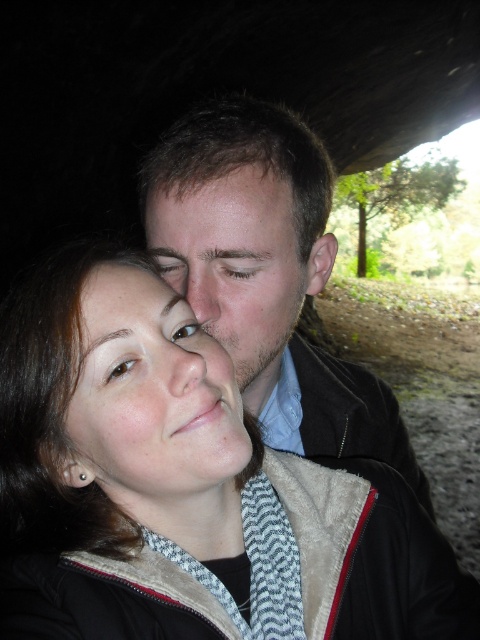
You are a photographer adjusting the lighting for a portrait. You notice two smooth skin faces in the frame. The smooth skin face at center belongs to the man, and the smooth skin face at upper center is the woman. Which face should you focus on to ensure proper exposure for the subject looking at the camera?

The smooth skin face at upper center is the woman, who is looking at the camera, so focus on her face for proper exposure.

You are holding a camera and want to take a photo of the scene. The camera has a focus point at point (x=105, y=467). If the camera can focus on objects within 20 inches from the viewer, will the focus point be within range?

The distance of point (x=105, y=467) from the viewer is 18.15 inches, which is within the camera focus range of 20 inches. Therefore, the focus point will be within range.

You are a photographer adjusting the focus on your camera. You need to ensure both the smooth skin face at center and the matte skin at center are in focus. The camera can only focus on objects within a 5 inch range. Can both be in focus?

The smooth skin face at center and the matte skin at center are 6.81 inches apart, which exceeds the camera focus range of 5 inches. Therefore, both cannot be in focus simultaneously.